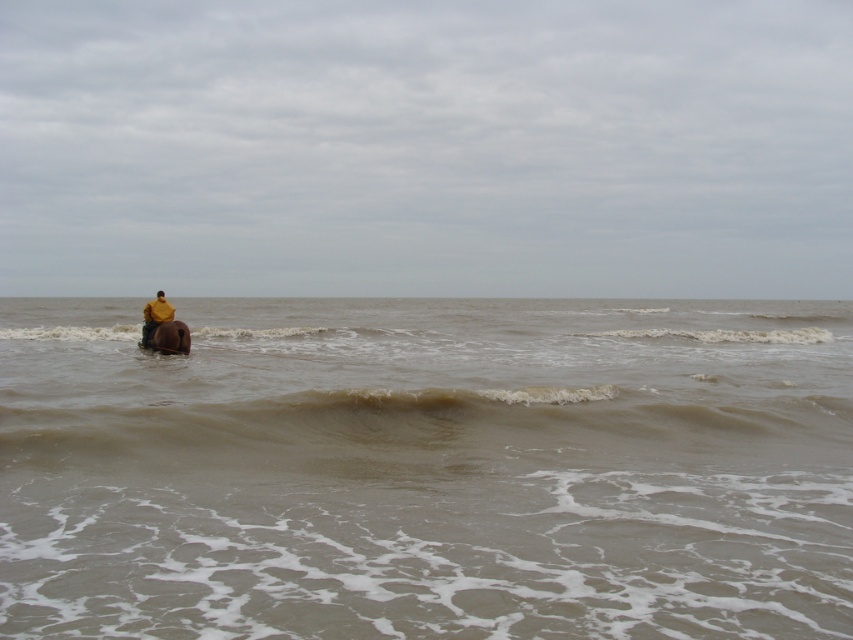
You are a photographer trying to capture the horse and rider in the scene. Since the brown muddy water at left and the brown matte horse at left are both on the left side of the frame, which one is closer to the center of the image?

The brown muddy water at left is to the right of the brown matte horse at left, so the brown muddy water at left is closer to the center of the image.

You are a photographer trying to capture the rider on the horse in the brown muddy water at left. Where should you position yourself to ensure the rider is centered in your shot?

To center the rider on the horse in the brown muddy water at left, position yourself at point (427, 468) as indicated by the coordinates provided.